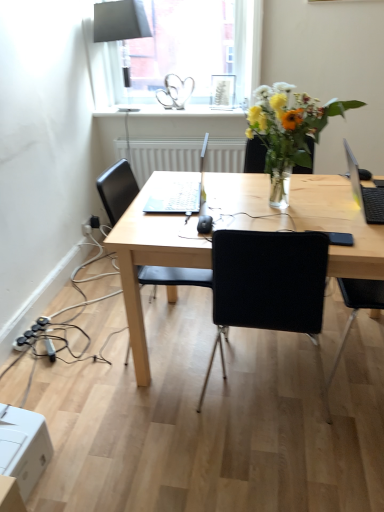
In order to click on free space between black plastic mouse at center and black matte laptop at right in this screenshot , I will do `click(310, 210)`.